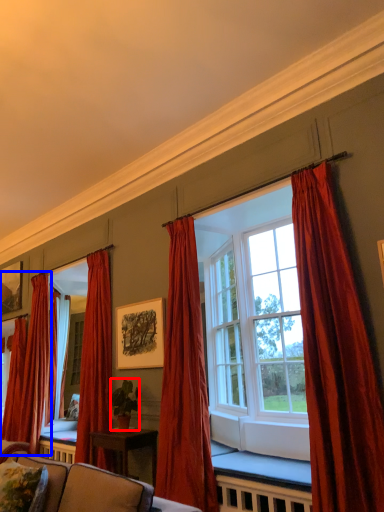
Question: Which of the following is the farthest to the observer, houseplant (highlighted by a red box) or curtain (highlighted by a blue box)?

Choices:
 (A) houseplant
 (B) curtain

Answer: (B)